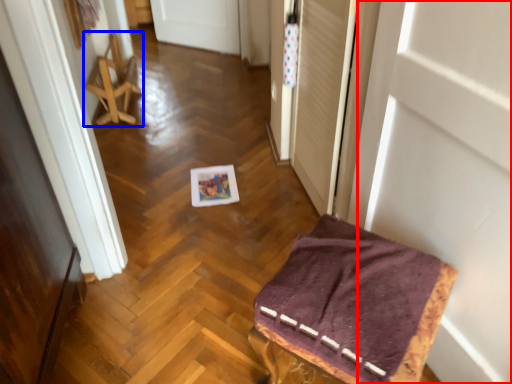
Question: Which object is closer to the camera taking this photo, door (highlighted by a red box) or furniture (highlighted by a blue box)?

Choices:
 (A) door
 (B) furniture

Answer: (A)